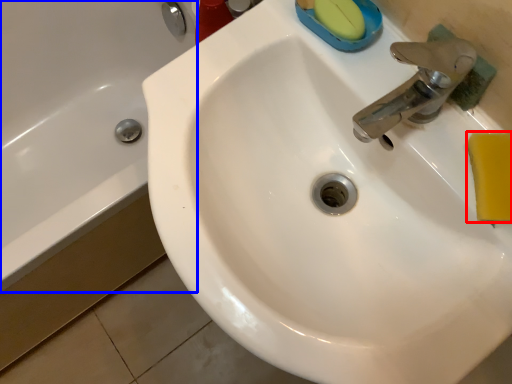
Question: Which object is closer to the camera taking this photo, soap (highlighted by a red box) or bath (highlighted by a blue box)?

Choices:
 (A) soap
 (B) bath

Answer: (A)